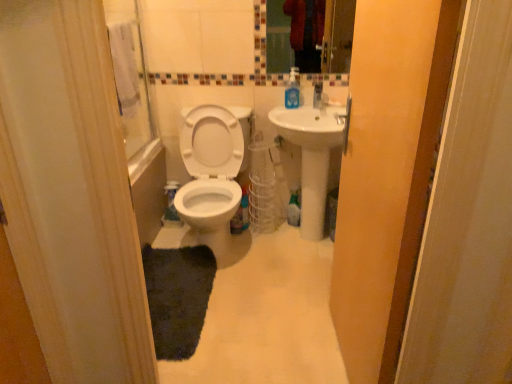
Question: Is matte glass mirror at upper center inside the boundaries of white glossy toilet at center, or outside?

Choices:
 (A) outside
 (B) inside

Answer: (A)

Question: Visually, is matte glass mirror at upper center positioned to the left or to the right of white glossy toilet at center?

Choices:
 (A) left
 (B) right

Answer: (B)

Question: Which of these objects is positioned farthest from the transparent plastic screen door at upper center?

Choices:
 (A) white glossy toilet at center
 (B) matte glass mirror at upper center
 (C) white matte toilet at center
 (D) white ceramic sink at center
 (E) dark gray plush rug at center

Answer: (B)

Question: Which is nearer to the white glossy toilet at center?

Choices:
 (A) dark gray plush rug at center
 (B) blue translucent soap dispenser at upper right
 (C) transparent plastic screen door at upper center
 (D) white matte toilet at center
 (E) matte glass mirror at upper center

Answer: (A)